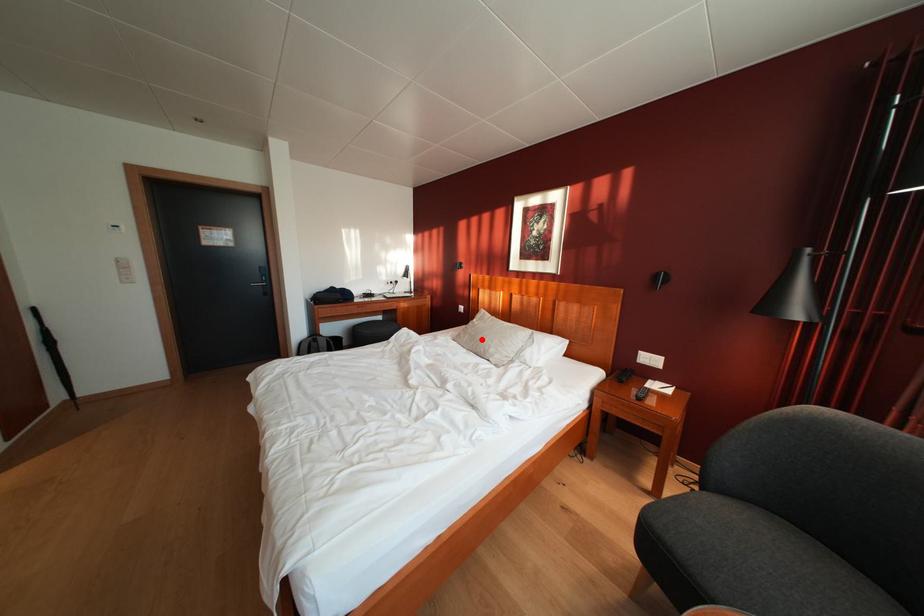
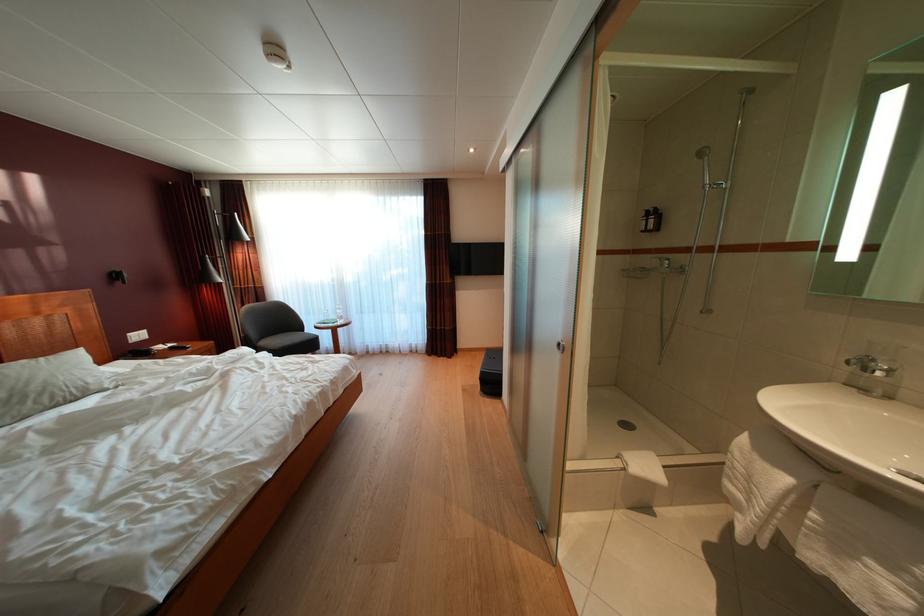
Where in the second image is the point corresponding to the highlighted location from the first image?

(10, 400)